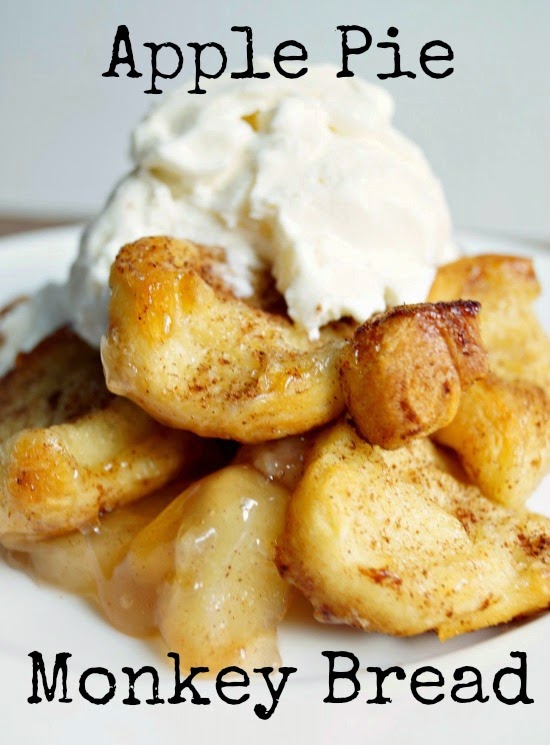
At what (x,y) coordinates should I click in order to perform the action: click on wall. Please return your answer as a coordinate pair (x, y). Looking at the image, I should click on 504,159.